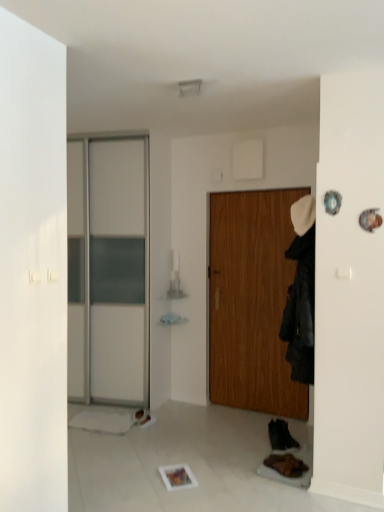
Question: Is wooden door at center positioned with its back to black fabric coat at right?

Choices:
 (A) yes
 (B) no

Answer: (B)

Question: Considering the relative positions of wooden door at center and black fabric coat at right in the image provided, is wooden door at center to the right of black fabric coat at right from the viewer's perspective?

Choices:
 (A) no
 (B) yes

Answer: (A)

Question: Does wooden door at center have a lesser height compared to black fabric coat at right?

Choices:
 (A) no
 (B) yes

Answer: (A)

Question: Can black fabric coat at right be found inside wooden door at center?

Choices:
 (A) no
 (B) yes

Answer: (A)

Question: Can you confirm if wooden door at center is taller than black fabric coat at right?

Choices:
 (A) yes
 (B) no

Answer: (A)

Question: Is brown suede shoe at lower right, placed as the 1th shoe when sorted from front to back, spatially inside black fabric coat at right, or outside of it?

Choices:
 (A) inside
 (B) outside

Answer: (B)

Question: Is point (297, 477) closer or farther from the camera than point (294, 332)?

Choices:
 (A) closer
 (B) farther

Answer: (A)

Question: Relative to black fabric coat at right, is brown suede shoe at lower right, placed as the 1th shoe when sorted from front to back, in front or behind?

Choices:
 (A) behind
 (B) front

Answer: (A)

Question: From a real-world perspective, relative to black fabric coat at right, is brown suede shoe at lower right, placed as the 1th shoe when sorted from front to back, vertically above or below?

Choices:
 (A) below
 (B) above

Answer: (A)

Question: Relative to brown suede shoe at lower right, placed as the 1th shoe when sorted from front to back, is black leather shoe at lower right, which appears as the 3th shoe when viewed from the left, in front or behind?

Choices:
 (A) behind
 (B) front

Answer: (A)

Question: In the image, is black leather shoe at lower right, arranged as the second shoe when viewed from the back, on the left side or the right side of brown suede shoe at lower right, which ranks as the 2th shoe in right-to-left order?

Choices:
 (A) left
 (B) right

Answer: (B)

Question: Is black leather shoe at lower right, which appears as the 3th shoe when viewed from the left, bigger or smaller than brown suede shoe at lower right, which ranks as the 2th shoe in right-to-left order?

Choices:
 (A) small
 (B) big

Answer: (B)

Question: From their relative heights in the image, would you say black leather shoe at lower right, which ranks as the 2th shoe in front-to-back order, is taller or shorter than brown suede shoe at lower right, the 2th shoe from the left?

Choices:
 (A) tall
 (B) short

Answer: (A)

Question: Considering the positions of white leather shoe at lower center, the third shoe when ordered from right to left, and black leather shoe at lower right, arranged as the second shoe when viewed from the back, in the image, is white leather shoe at lower center, the third shoe when ordered from right to left, bigger or smaller than black leather shoe at lower right, arranged as the second shoe when viewed from the back,?

Choices:
 (A) big
 (B) small

Answer: (B)

Question: Is white leather shoe at lower center, which ranks as the 1th shoe in back-to-front order, taller or shorter than black leather shoe at lower right, which appears as the 3th shoe when viewed from the left?

Choices:
 (A) short
 (B) tall

Answer: (A)